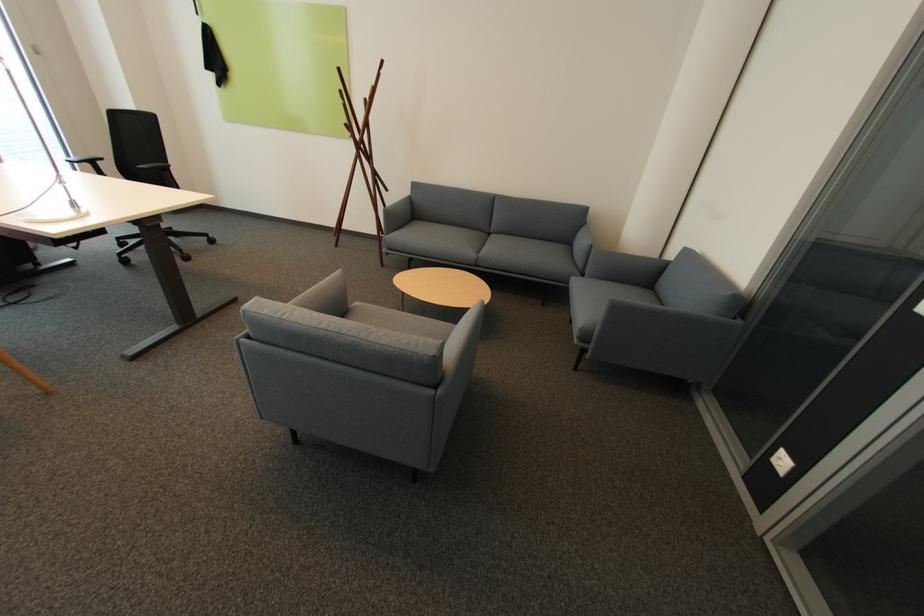
Image resolution: width=924 pixels, height=616 pixels. What do you see at coordinates (460, 353) in the screenshot?
I see `the grey sofa armrest` at bounding box center [460, 353].